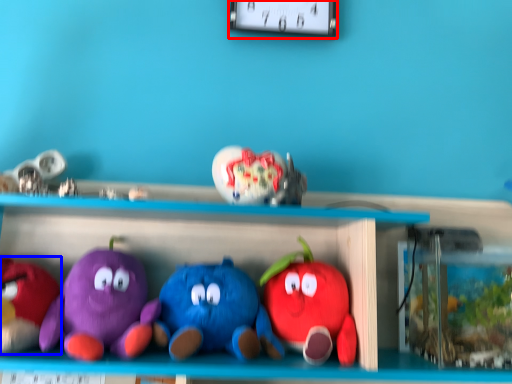
Question: Which point is further to the camera, clock (highlighted by a red box) or toy (highlighted by a blue box)?

Choices:
 (A) clock
 (B) toy

Answer: (A)